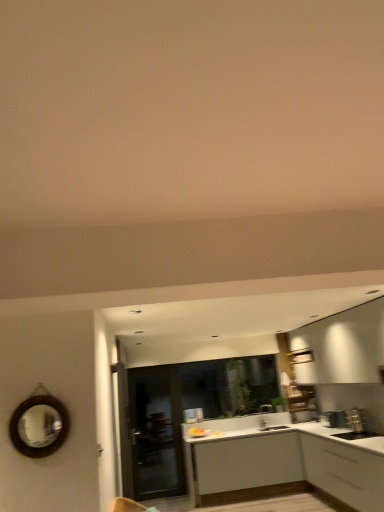
Question: From the image's perspective, is white matte cabinet at center, marked as the second cabinetry in a front-to-back arrangement, beneath matte black door at center?

Choices:
 (A) no
 (B) yes

Answer: (B)

Question: Is white matte cabinet at center, marked as the second cabinetry in a front-to-back arrangement, wider than matte black door at center?

Choices:
 (A) yes
 (B) no

Answer: (A)

Question: Does white matte cabinet at center, marked as the second cabinetry in a front-to-back arrangement, contain matte black door at center?

Choices:
 (A) no
 (B) yes

Answer: (A)

Question: From the image's perspective, is white matte cabinet at center, marked as the second cabinetry in a front-to-back arrangement, located above matte black door at center?

Choices:
 (A) no
 (B) yes

Answer: (A)

Question: Considering the relative positions of white matte cabinet at center, the first cabinetry when ordered from back to front, and matte black door at center in the image provided, is white matte cabinet at center, the first cabinetry when ordered from back to front, to the left of matte black door at center from the viewer's perspective?

Choices:
 (A) no
 (B) yes

Answer: (A)

Question: Is white matte cabinet at center, the first cabinetry when ordered from back to front, oriented towards matte black door at center?

Choices:
 (A) no
 (B) yes

Answer: (B)

Question: Can you confirm if matte black door at center is positioned to the right of white matte cabinet at center, the first cabinetry when ordered from back to front?

Choices:
 (A) no
 (B) yes

Answer: (A)

Question: Can you confirm if matte black door at center is smaller than white matte cabinet at center, the first cabinetry when ordered from back to front?

Choices:
 (A) no
 (B) yes

Answer: (B)

Question: Is matte black door at center outside of white matte cabinet at center, the first cabinetry when ordered from back to front?

Choices:
 (A) yes
 (B) no

Answer: (A)

Question: From a real-world perspective, is matte black door at center beneath white matte cabinet at center, the first cabinetry when ordered from back to front?

Choices:
 (A) no
 (B) yes

Answer: (A)

Question: Can you confirm if matte black door at center is bigger than white matte cabinet at center, the first cabinetry when ordered from back to front?

Choices:
 (A) no
 (B) yes

Answer: (A)

Question: Are matte black door at center and white matte cabinet at center, marked as the second cabinetry in a front-to-back arrangement, located far from each other?

Choices:
 (A) no
 (B) yes

Answer: (B)

Question: Is silver metallic faucet at center far away from white matte cabinet at lower right, marked as the 1th cabinetry in a front-to-back arrangement?

Choices:
 (A) yes
 (B) no

Answer: (A)